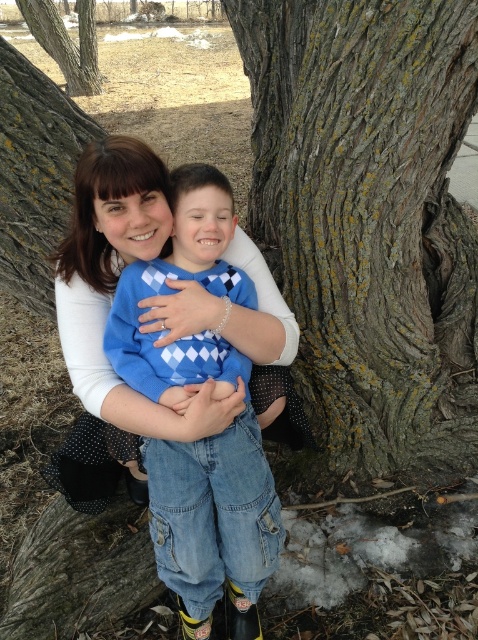
Is blue argyle sweater at center further to camera compared to rough bark tree at upper left?

No, blue argyle sweater at center is closer to the viewer.

Does blue argyle sweater at center appear over rough bark tree at upper left?

No, blue argyle sweater at center is not above rough bark tree at upper left.

Does point (191, 262) come behind point (25, 3)?

That is False.

Locate an element on the screen. Image resolution: width=478 pixels, height=640 pixels. blue argyle sweater at center is located at coordinates (206, 436).

Who is positioned more to the left, rough bark tree at center or rough bark tree at upper left?

rough bark tree at upper left is more to the left.

Which is more to the right, rough bark tree at center or rough bark tree at upper left?

From the viewer's perspective, rough bark tree at center appears more on the right side.

Is point (410, 385) closer to camera compared to point (51, 42)?

That is True.

What are the coordinates of `rough bark tree at center` in the screenshot? It's located at (369, 216).

Is rough bark tree at center to the left of blue argyle sweater at center from the viewer's perspective?

Incorrect, rough bark tree at center is not on the left side of blue argyle sweater at center.

In the scene shown: Is rough bark tree at center closer to camera compared to blue argyle sweater at center?

No.

Between point (356, 244) and point (281, 524), which one is positioned behind?

Positioned behind is point (356, 244).

Identify the location of rough bark tree at center. This screenshot has width=478, height=640. (369, 216).